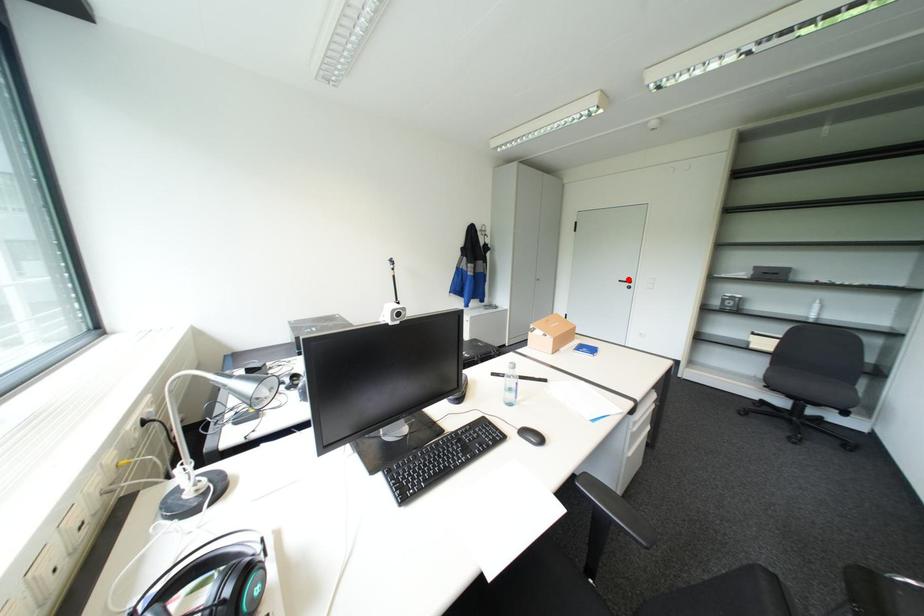
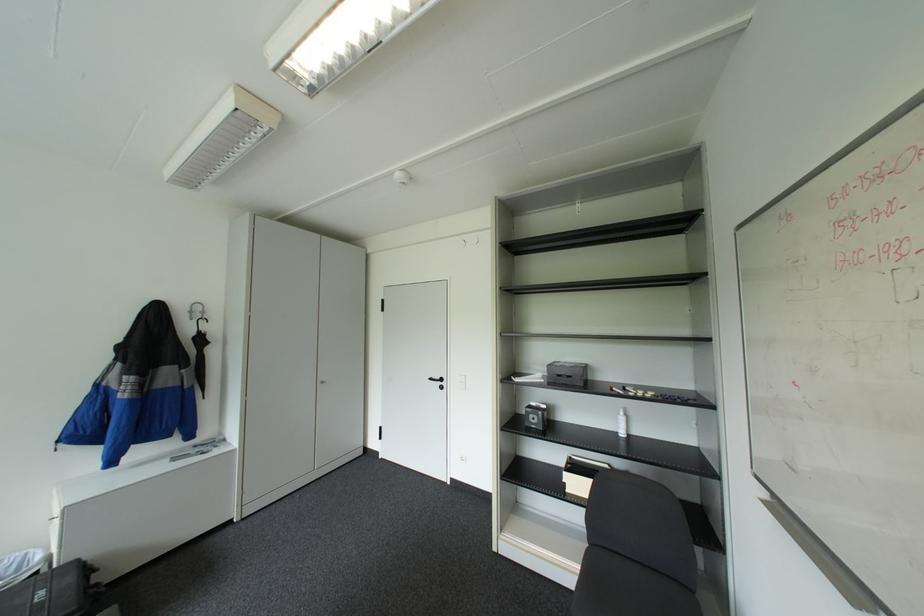
Locate, in the second image, the point that corresponds to the highlighted location in the first image.

(439, 378)